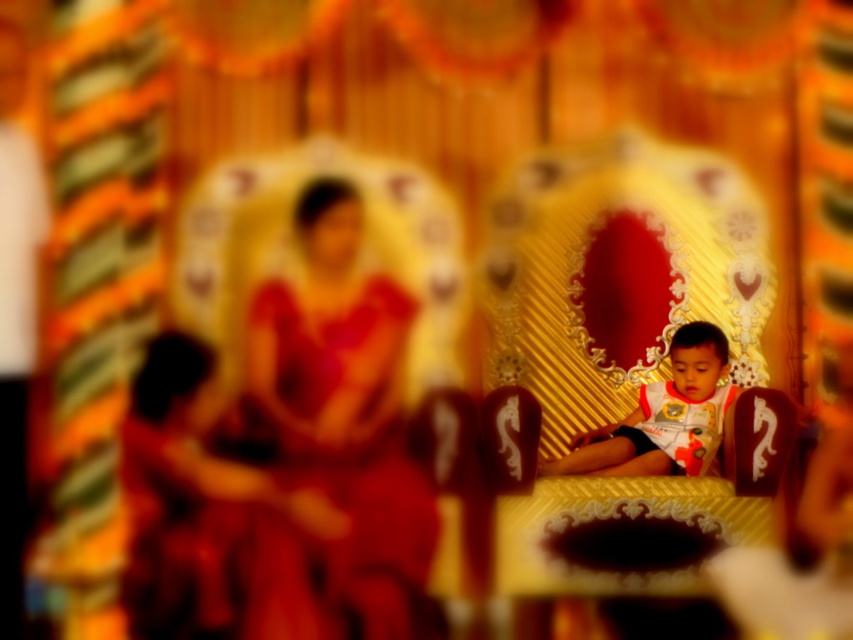
In the festive scene, there is a matte red robe at center and a white printed shirt at center. Which one has a greater width?

The matte red robe at center has a greater width than the white printed shirt at center.

You are a photographer standing at the back of the scene. You want to take a photo that includes both the matte red robe at center and the matte red dress at left. What is the minimum distance you need to move backward to ensure both are in frame?

The minimum distance you need to move backward is 3.04 meters to ensure both the matte red robe at center and the matte red dress at left are in frame.